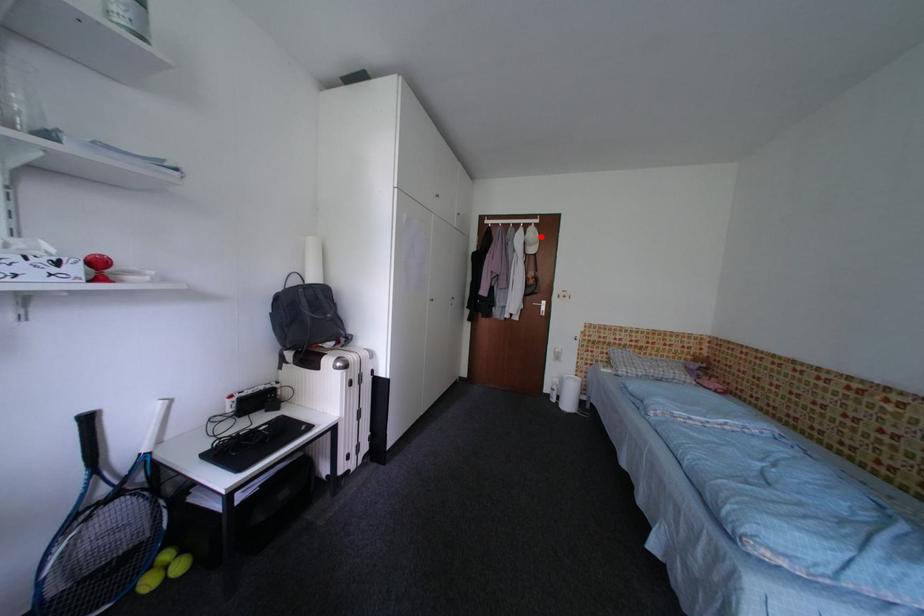
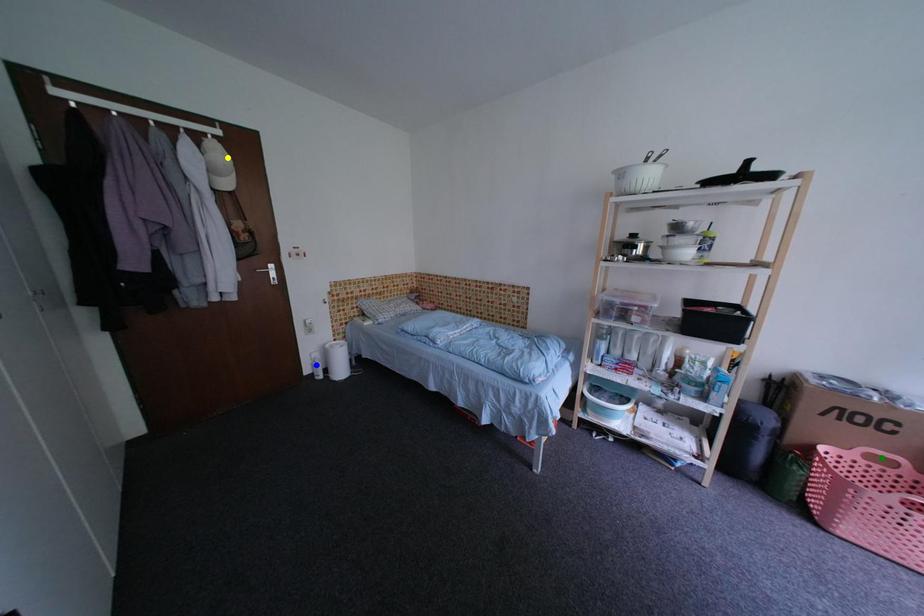
Question: I am providing you with two images of the same scene from different viewpoints. A red point is marked on the first image. You are given multiple points on the second image. Which spot in image 2 lines up with the point in image 1?

Choices:
 (A) blue point
 (B) yellow point
 (C) green point

Answer: (B)